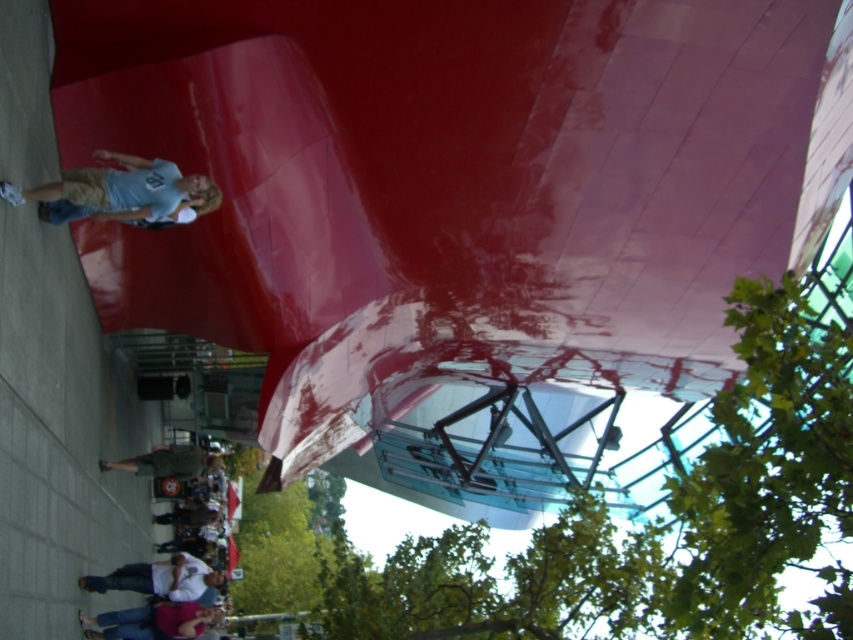
Looking at this image, you are a photographer trying to capture a clear shot of the white matte skateboard at lower center without the denim pants at lower center blocking it. Based on their heights, is this possible?

The denim pants at lower center has a greater height compared to the white matte skateboard at lower center. Therefore, it is possible to capture a clear shot of the white matte skateboard at lower center without the denim pants blocking it by adjusting the camera angle to position the skateboard below the denim pants.

You are a photographer positioned at the edge of the paved area in the urban scene. You want to capture a clear shot of the white matte skateboard at lower center without any obstruction. Is the denim pants at lower center blocking your view of the skateboard?

The denim pants at lower center is in front of the white matte skateboard at lower center, so it is blocking the view of the skateboard. To capture a clear shot, you would need to move around the denim pants at lower center or have them move out of the way.